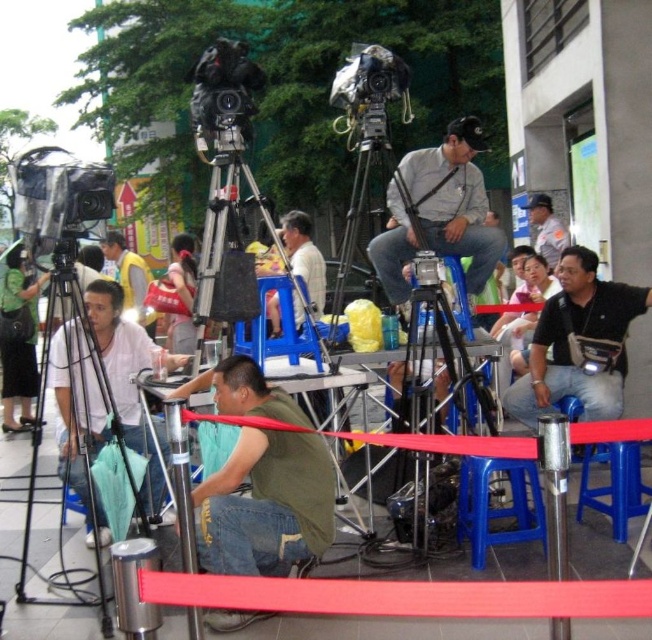
Question: Can you confirm if black matte tripod at lower left is positioned below blue plastic stool at lower center?

Choices:
 (A) no
 (B) yes

Answer: (B)

Question: Which is nearer to the matte gray shirt at center?

Choices:
 (A) light brown leather jacket at center
 (B) black leather jacket at center
 (C) blue plastic stool at lower center

Answer: (B)

Question: Does green cotton shirt at center have a smaller size compared to matte white shirt at lower left?

Choices:
 (A) yes
 (B) no

Answer: (A)

Question: Which point is farther from the camera taking this photo?

Choices:
 (A) [x=128, y=268]
 (B) [x=550, y=243]
 (C) [x=466, y=282]

Answer: (A)

Question: Does matte white shirt at lower left have a greater width compared to black leather jacket at center?

Choices:
 (A) no
 (B) yes

Answer: (B)

Question: Among these objects, which one is farthest from the camera?

Choices:
 (A) blue plastic stool at lower center
 (B) black leather jacket at center
 (C) matte white shirt at lower left

Answer: (B)